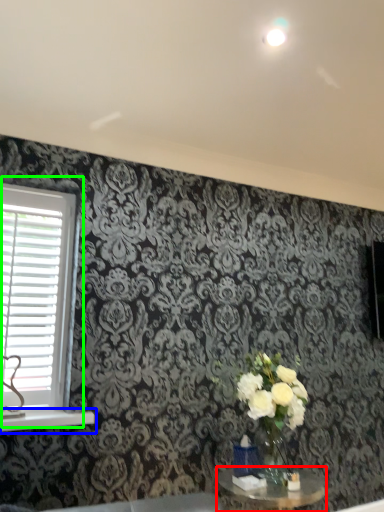
Question: Which object is the closest to the table (highlighted by a red box)? Choose among these: window sill (highlighted by a blue box) or window (highlighted by a green box).

Choices:
 (A) window sill
 (B) window

Answer: (A)